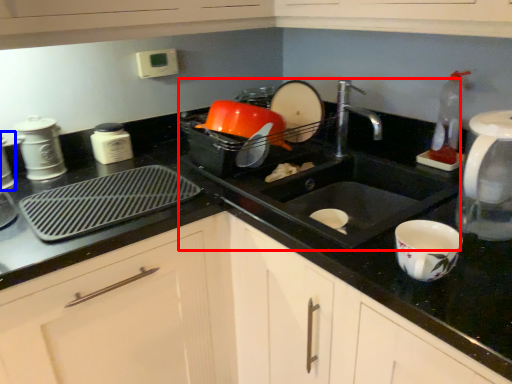
Question: Which of the following is the closest to the observer, sink (highlighted by a red box) or appliance (highlighted by a blue box)?

Choices:
 (A) sink
 (B) appliance

Answer: (A)